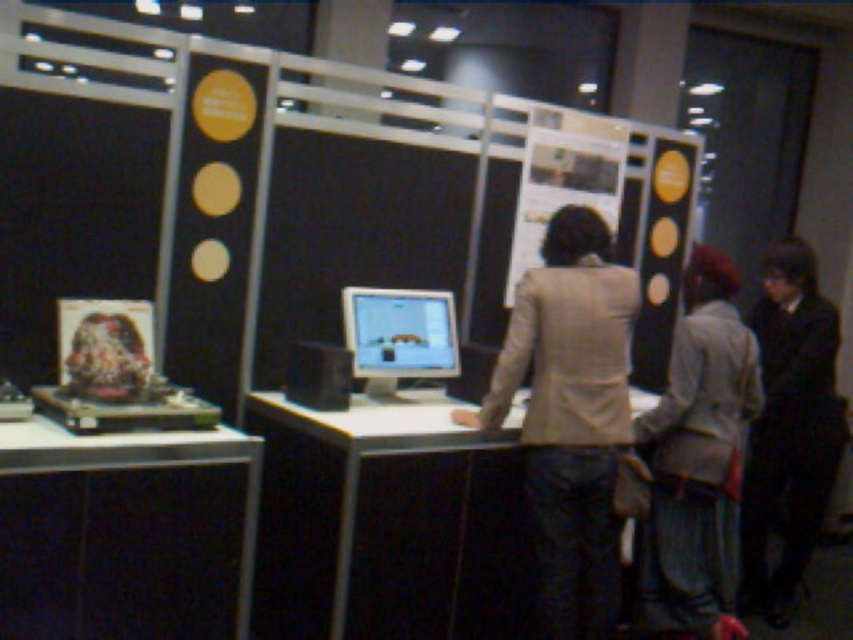
Is metallic silver computer at center taller than black fabric jacket at upper right?

No, metallic silver computer at center is not taller than black fabric jacket at upper right.

Is metallic silver computer at center thinner than black fabric jacket at upper right?

No, metallic silver computer at center is not thinner than black fabric jacket at upper right.

Is point (276, 548) positioned after point (776, 385)?

No, it is in front of (776, 385).

You are a GUI agent. You are given a task and a screenshot of the screen. Output one action in this format:
    pyautogui.click(x=<x>, y=<y>)
    Task: Click on the metallic silver computer at center
    This screenshot has height=640, width=853.
    Given the screenshot: What is the action you would take?
    pyautogui.click(x=387, y=524)

Between point (96, 512) and point (683, 529), which one is positioned behind?

Point (683, 529)

Who is higher up, metallic silver desk at lower left or light gray fabric jacket at center?

light gray fabric jacket at center is above.

Is point (61, 440) closer to viewer compared to point (712, 515)?

Yes, it is in front of point (712, 515).

You are a GUI agent. You are given a task and a screenshot of the screen. Output one action in this format:
    pyautogui.click(x=<x>, y=<y>)
    Task: Click on the metallic silver desk at lower left
    This screenshot has height=640, width=853.
    Given the screenshot: What is the action you would take?
    pyautogui.click(x=142, y=524)

Is point (357, 634) farther from viewer compared to point (242, 544)?

That is True.

Does metallic silver computer at center lie in front of metallic silver desk at lower left?

No.

The width and height of the screenshot is (853, 640). Describe the element at coordinates (387, 524) in the screenshot. I see `metallic silver computer at center` at that location.

Locate an element on the screen. The height and width of the screenshot is (640, 853). metallic silver computer at center is located at coordinates (387, 524).